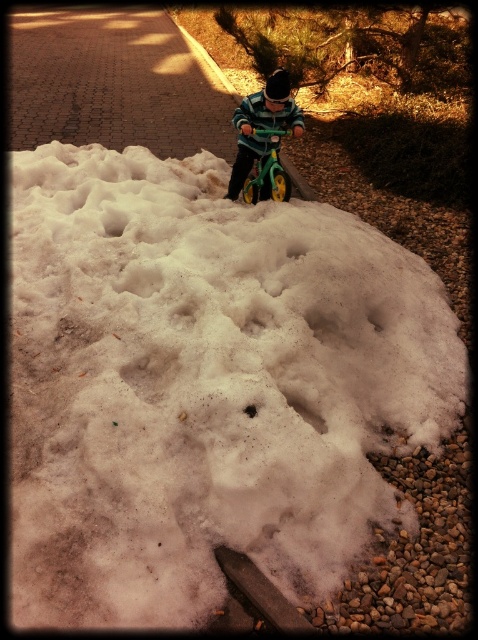
Which is below, white fluffy snow at center or striped sweater at center?

white fluffy snow at center is lower down.

Can you confirm if white fluffy snow at center is positioned above striped sweater at center?

Actually, white fluffy snow at center is below striped sweater at center.

Between point (319, 252) and point (300, 134), which one is positioned behind?

The point (300, 134) is more distant.

The width and height of the screenshot is (478, 640). Find the location of `white fluffy snow at center`. white fluffy snow at center is located at coordinates (204, 387).